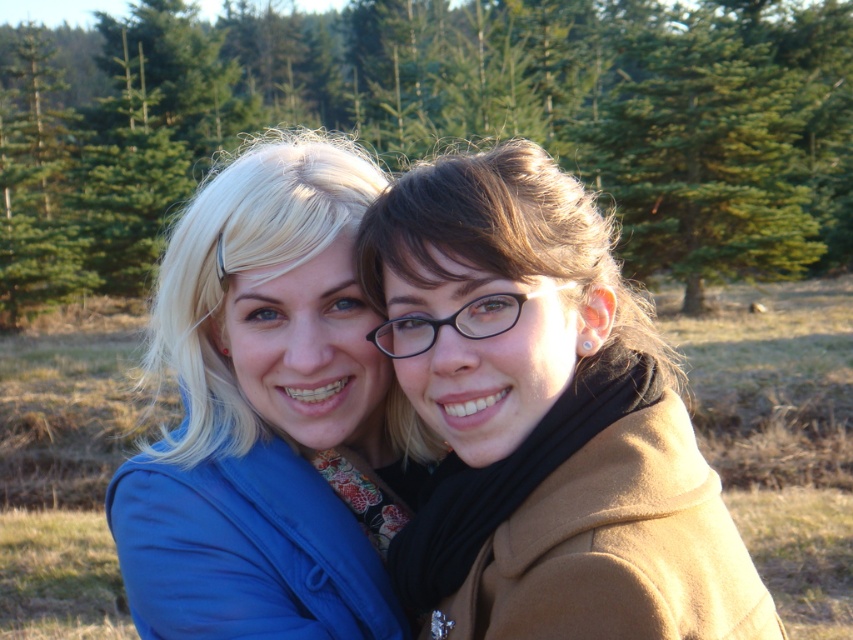
Question: Can you confirm if green matte tree at center is thinner than brown woolen coat at right?

Choices:
 (A) no
 (B) yes

Answer: (A)

Question: Which point is farther to the camera?

Choices:
 (A) blue fabric jacket at center
 (B) green matte tree at center
 (C) brown woolen coat at right

Answer: (B)

Question: Is green matte tree at center wider than blue fabric jacket at center?

Choices:
 (A) yes
 (B) no

Answer: (A)

Question: Which object is closer to the camera taking this photo?

Choices:
 (A) brown woolen coat at right
 (B) blue fabric jacket at center

Answer: (A)

Question: Is brown woolen coat at right further to camera compared to blue fabric jacket at center?

Choices:
 (A) yes
 (B) no

Answer: (B)

Question: Among these points, which one is farthest from the camera?

Choices:
 (A) [x=715, y=198]
 (B) [x=503, y=602]
 (C) [x=184, y=380]

Answer: (A)